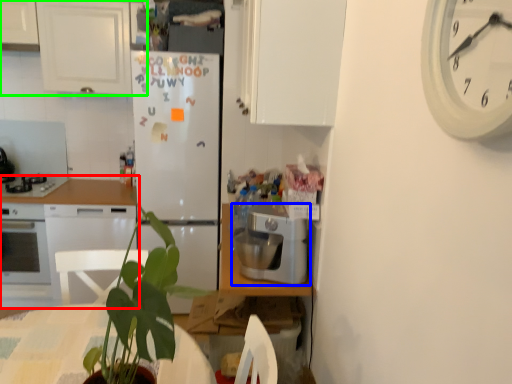
Question: Which object is the farthest from countertop (highlighted by a red box)? Choose among these: kitchen appliance (highlighted by a blue box) or cabinetry (highlighted by a green box).

Choices:
 (A) kitchen appliance
 (B) cabinetry

Answer: (A)